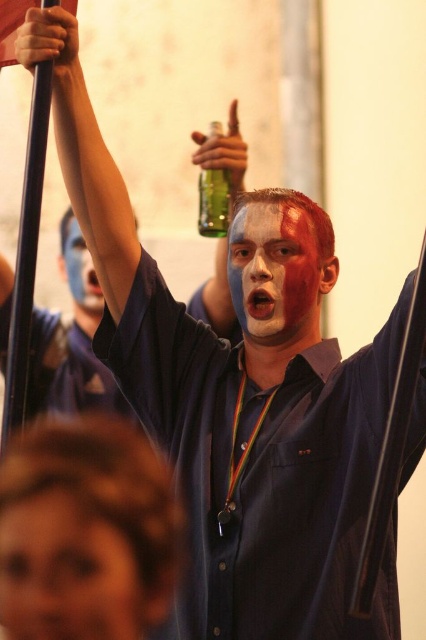
Question: Considering the relative positions of matte blue face paint at lower left and painted face at center in the image provided, where is matte blue face paint at lower left located with respect to painted face at center?

Choices:
 (A) left
 (B) right

Answer: (A)

Question: Among these points, which one is nearest to the camera?

Choices:
 (A) (75, 243)
 (B) (242, 317)
 (C) (215, 170)

Answer: (B)

Question: In this image, where is painted face at center located relative to blue matte face paint at upper center?

Choices:
 (A) right
 (B) left

Answer: (A)

Question: Is matte blue face paint at lower left positioned at the back of blue matte face paint at upper center?

Choices:
 (A) yes
 (B) no

Answer: (B)

Question: Among these objects, which one is nearest to the camera?

Choices:
 (A) green glass bottle at center
 (B) blue matte face paint at upper center

Answer: (A)

Question: Which is nearer to the blue matte face paint at upper center?

Choices:
 (A) matte blue face paint at lower left
 (B) painted face at center
 (C) green glass bottle at center

Answer: (C)